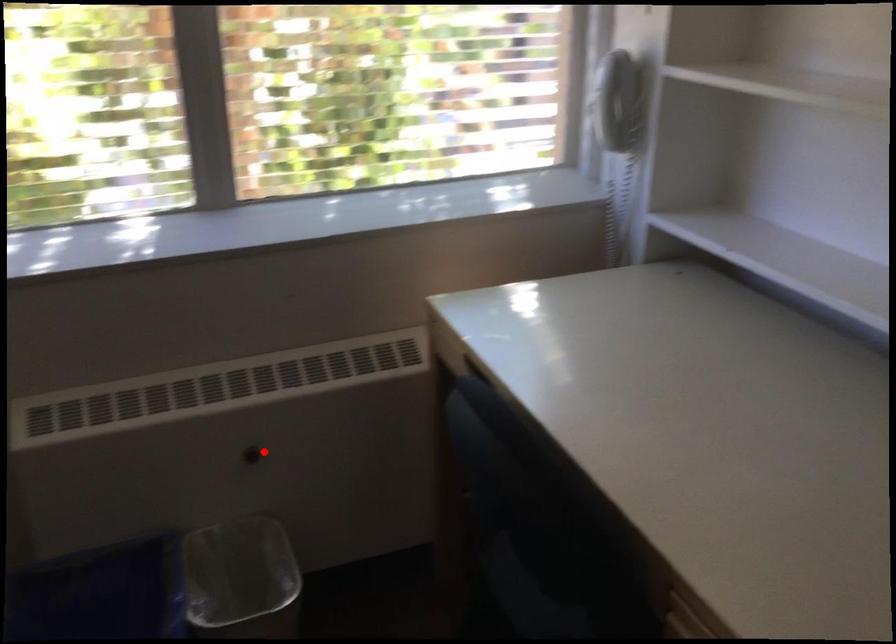
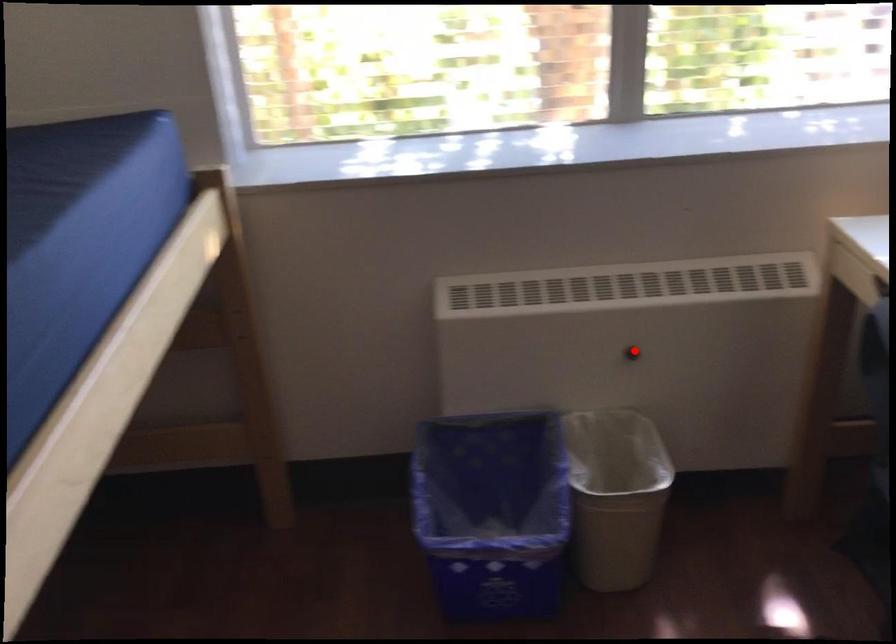
I am providing you with two images of the same scene from different viewpoints. A red point is marked on the first image and another point is marked on the second image. Is the red point in image1 aligned with the point shown in image2?

Yes